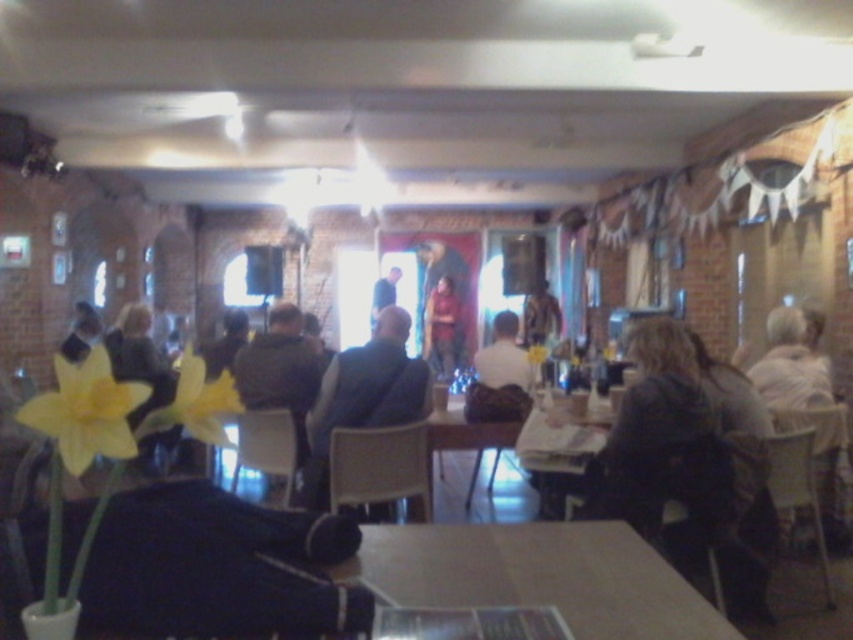
Is dark blue vest at center above dark brown leather jacket at center?

Incorrect, dark blue vest at center is not positioned above dark brown leather jacket at center.

Which is more to the left, dark blue vest at center or dark brown leather jacket at center?

dark brown leather jacket at center

Does point (373, 408) come behind point (277, 342)?

No, (373, 408) is in front of (277, 342).

Identify the location of dark blue vest at center. Image resolution: width=853 pixels, height=640 pixels. (364, 396).

The image size is (853, 640). Describe the element at coordinates (538, 576) in the screenshot. I see `wooden table at center` at that location.

Does wooden table at center appear on the left side of matte red shirt at center?

No, wooden table at center is not to the left of matte red shirt at center.

Find the location of a particular element. wooden table at center is located at coordinates (538, 576).

Is dark blue vest at center bigger than matte black jacket at left?

Yes.

Who is more distant from viewer, (386, 413) or (86, 339)?

Positioned behind is point (86, 339).

Which is in front, point (412, 385) or point (91, 310)?

Point (412, 385) is more forward.

Identify the location of dark blue vest at center. The image size is (853, 640). (364, 396).